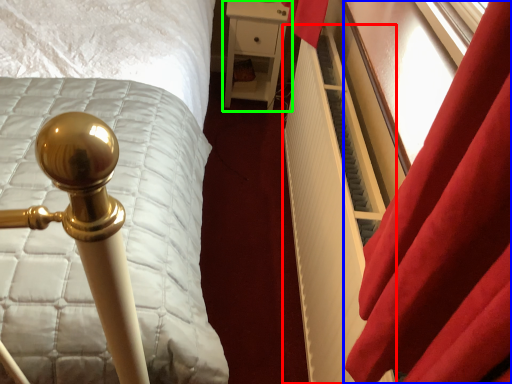
Question: Considering the real-world distances, which object is farthest from radiator (highlighted by a red box)? curtain (highlighted by a blue box) or furniture (highlighted by a green box)?

Choices:
 (A) curtain
 (B) furniture

Answer: (B)